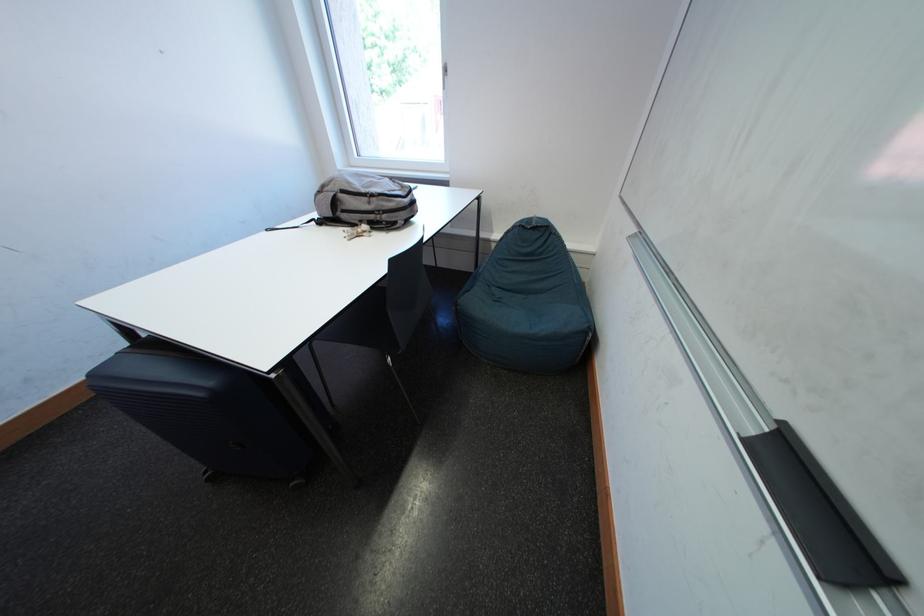
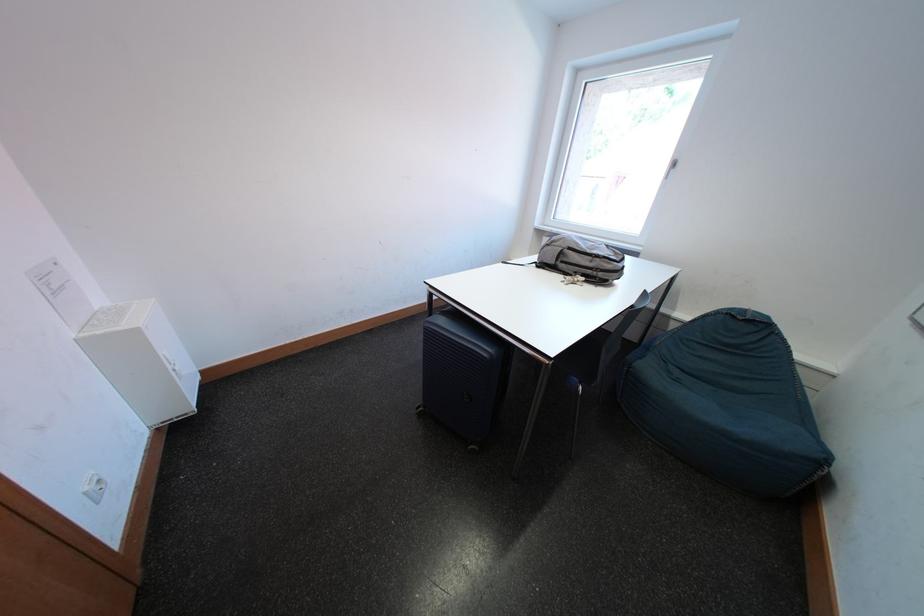
Find the pixel in the second image that matches point (347, 236) in the first image.

(569, 280)